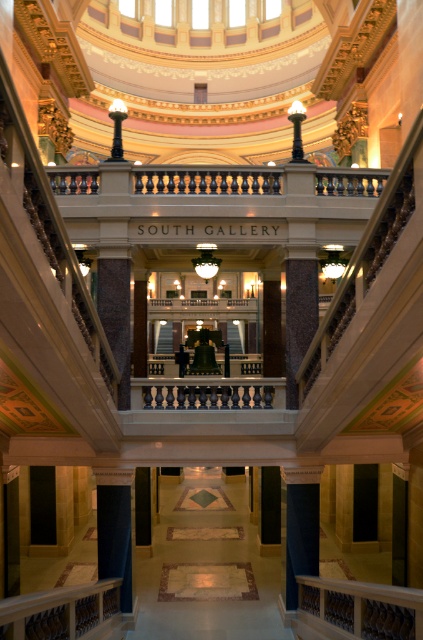
Question: Is polished marble staircase at right to the left of marble floor at center from the viewer's perspective?

Choices:
 (A) no
 (B) yes

Answer: (A)

Question: Which object is closer to the camera taking this photo?

Choices:
 (A) polished marble staircase at right
 (B) marble floor at center

Answer: (A)

Question: Is polished marble staircase at right positioned at the back of marble floor at center?

Choices:
 (A) yes
 (B) no

Answer: (B)

Question: Which point is closer to the camera?

Choices:
 (A) (353, 596)
 (B) (354, 253)

Answer: (A)

Question: From the image, what is the correct spatial relationship of polished marble staircase at right in relation to marble floor at center?

Choices:
 (A) above
 (B) below

Answer: (A)

Question: Which point is farther to the camera?

Choices:
 (A) wooden balustrade at lower right
 (B) marble floor at center

Answer: (B)